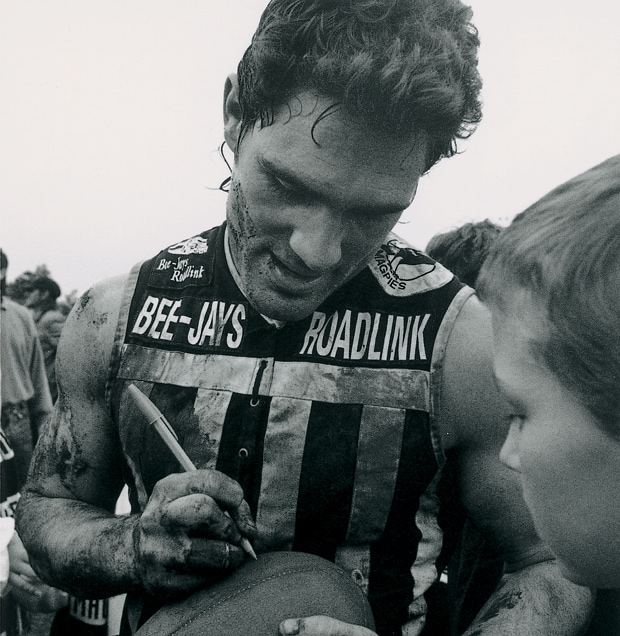
Locate an element on the screen. pen is located at coordinates (179, 453).